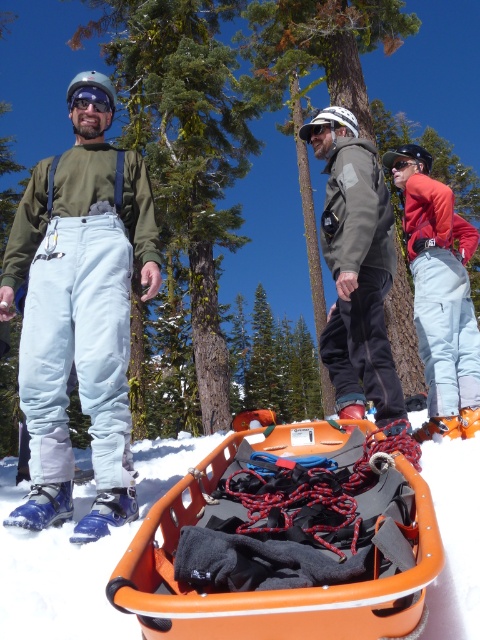
You are a search and rescue team member looking at the scene. You need to determine the position of the matte blue ski pants at left relative to the blue rubber snowshoe at lower left. Based on the scene, is the ski pants above or below the snowshoe?

The matte blue ski pants at left is above the blue rubber snowshoe at lower left according to the description.

You are standing at the point marked as point (372, 321) in the snowy scene. You want to take a photo of the orange rescue sled with your camera. If the camera is 11.14 feet away from you, will the orange rescue sled be in the frame?

The camera is 11.14 feet away from point (372, 321). Since you are at that point, the camera is 11.14 feet away from you. However, the question is whether the orange rescue sled is in the frame. Without knowing the field of view of the camera or the distance to the sled, we cannot determine if the sled is in the frame. The given information only specifies the distance between you and the camera, not the sled.

You are a search and rescue team member looking at the scene. You need to determine which item is taller between the matte orange ski boot at right and the blue rubber snowshoe at lower left. Which one is taller?

The matte orange ski boot at right is taller than the blue rubber snowshoe at lower left according to the description.